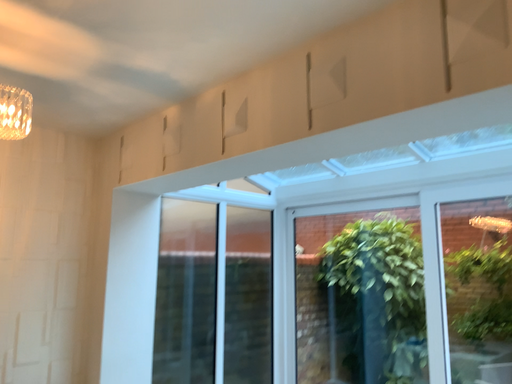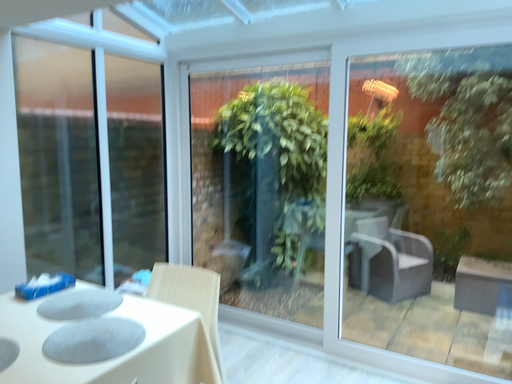
Question: How did the camera likely rotate when shooting the video?

Choices:
 (A) rotated right
 (B) rotated left

Answer: (A)